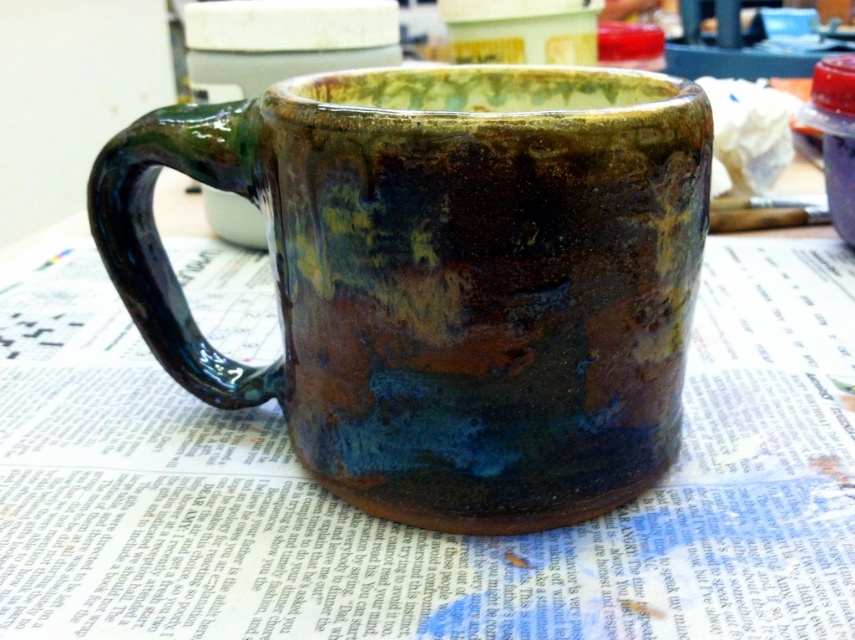
Is matte ceramic mug at center further to camera compared to rustic ceramic mug at center?

No, matte ceramic mug at center is closer to the viewer.

Does matte ceramic mug at center appear on the right side of rustic ceramic mug at center?

Yes, matte ceramic mug at center is to the right of rustic ceramic mug at center.

Where is `matte ceramic mug at center`? This screenshot has height=640, width=855. matte ceramic mug at center is located at coordinates (417, 529).